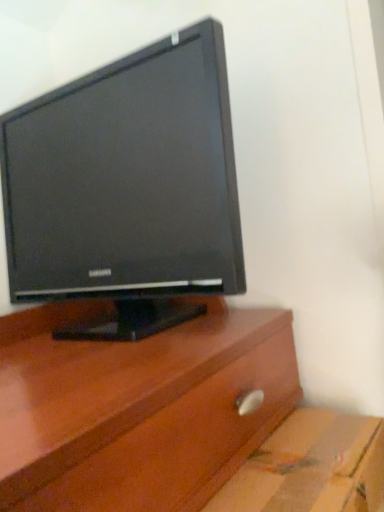
Locate an element on the screen. Image resolution: width=384 pixels, height=512 pixels. empty space that is ontop of cardboard at lower right (from a real-world perspective) is located at coordinates (319, 451).